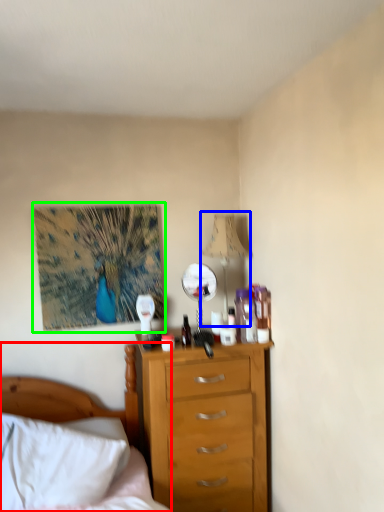
Question: Which object is positioned farthest from bed (highlighted by a red box)? Select from lamp (highlighted by a blue box) and picture frame (highlighted by a green box).

Choices:
 (A) lamp
 (B) picture frame

Answer: (A)